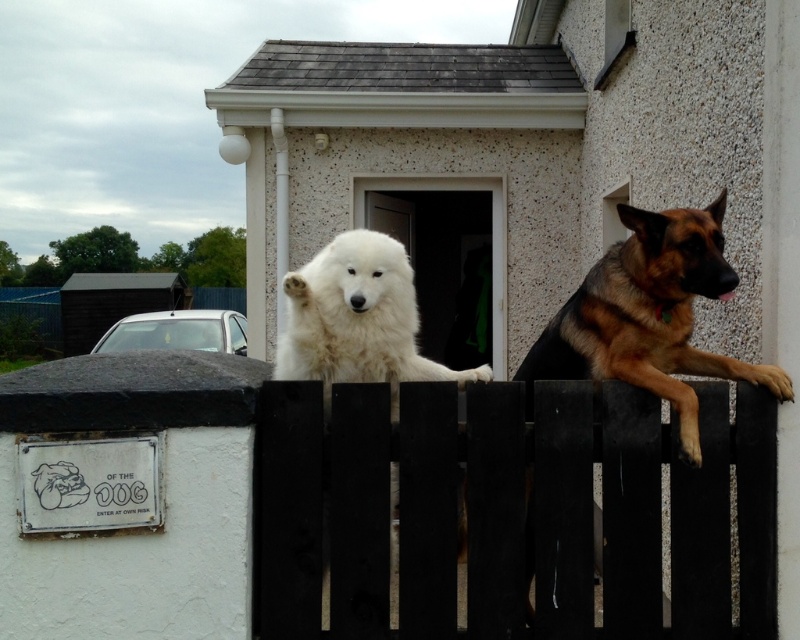
Is black wooden fence at center to the right of white fluffy dog at center from the viewer's perspective?

Indeed, black wooden fence at center is positioned on the right side of white fluffy dog at center.

Is black wooden fence at center to the left of white fluffy dog at center from the viewer's perspective?

Incorrect, black wooden fence at center is not on the left side of white fluffy dog at center.

What do you see at coordinates (509, 509) in the screenshot?
I see `black wooden fence at center` at bounding box center [509, 509].

Where is `black wooden fence at center`? The image size is (800, 640). black wooden fence at center is located at coordinates (509, 509).

Is brown fur dog at right positioned at the back of white fluffy dog at center?

Yes, it is behind white fluffy dog at center.

Can you confirm if brown fur dog at right is shorter than white fluffy dog at center?

Incorrect, brown fur dog at right's height does not fall short of white fluffy dog at center's.

Looking at this image, measure the distance between brown fur dog at right and camera.

2.55 meters

Identify the location of brown fur dog at right. (649, 316).

The height and width of the screenshot is (640, 800). I want to click on black wooden fence at center, so click(509, 509).

Who is higher up, black wooden fence at center or brown fur dog at right?

brown fur dog at right is above.

What do you see at coordinates (509, 509) in the screenshot? The height and width of the screenshot is (640, 800). I see `black wooden fence at center` at bounding box center [509, 509].

Image resolution: width=800 pixels, height=640 pixels. Identify the location of black wooden fence at center. (509, 509).